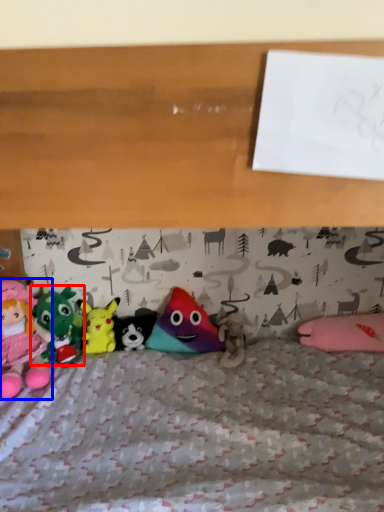
Question: Among these objects, which one is farthest to the camera, toy (highlighted by a red box) or toy (highlighted by a blue box)?

Choices:
 (A) toy
 (B) toy

Answer: (A)